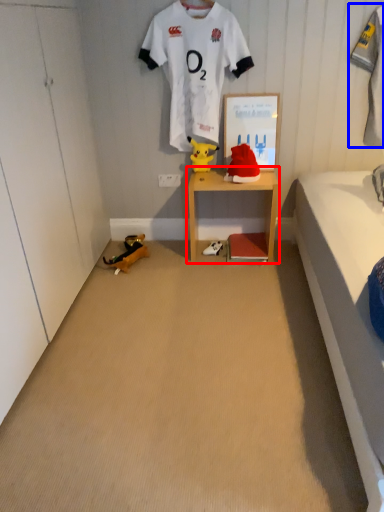
Question: Which object appears closest to the camera in this image, shelf (highlighted by a red box) or clothing (highlighted by a blue box)?

Choices:
 (A) shelf
 (B) clothing

Answer: (B)